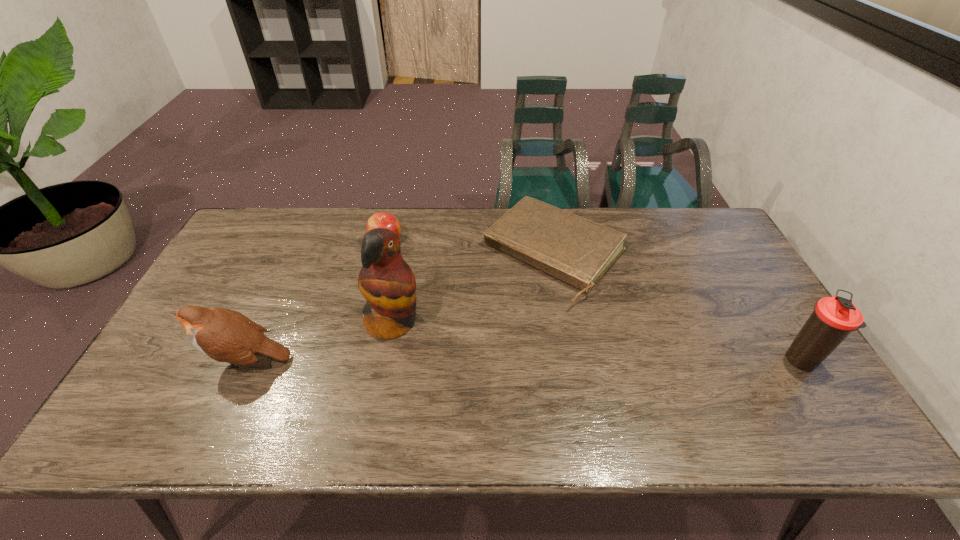
This screenshot has width=960, height=540. In order to click on vacant area at the left edge of the desktop in this screenshot , I will do `click(181, 351)`.

The height and width of the screenshot is (540, 960). I want to click on vacant space at the right edge of the desktop, so click(x=744, y=318).

In order to click on vacant space at the far left corner of the desktop in this screenshot , I will do `click(276, 222)`.

Identify the location of free space at the far right corner of the desktop. Image resolution: width=960 pixels, height=540 pixels. (708, 229).

The height and width of the screenshot is (540, 960). In order to click on vacant space in between the parrot and the thermos bottle in this screenshot , I will do coord(597,341).

You are a GUI agent. You are given a task and a screenshot of the screen. Output one action in this format:
    pyautogui.click(x=<x>, y=<y>)
    Task: Click on the vacant area between the fourth shortest object and the tallest object
    This screenshot has width=960, height=540.
    Given the screenshot: What is the action you would take?
    coord(597,341)

Where is `vacant area that lies between the parrot and the leftmost object`? vacant area that lies between the parrot and the leftmost object is located at coordinates (320, 341).

I want to click on free space between the rightmost object and the fourth object from left to right, so pos(678,307).

Identify the location of unoccupied area between the third shortest object and the fourth tallest object. (317, 301).

Where is `free space that is in between the fourth object from left to right and the apple`? The image size is (960, 540). free space that is in between the fourth object from left to right and the apple is located at coordinates (470, 248).